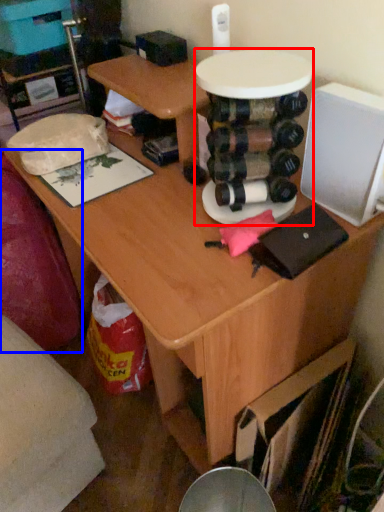
Question: Which object appears farthest to the camera in this image, round table (highlighted by a red box) or swivel chair (highlighted by a blue box)?

Choices:
 (A) round table
 (B) swivel chair

Answer: (B)